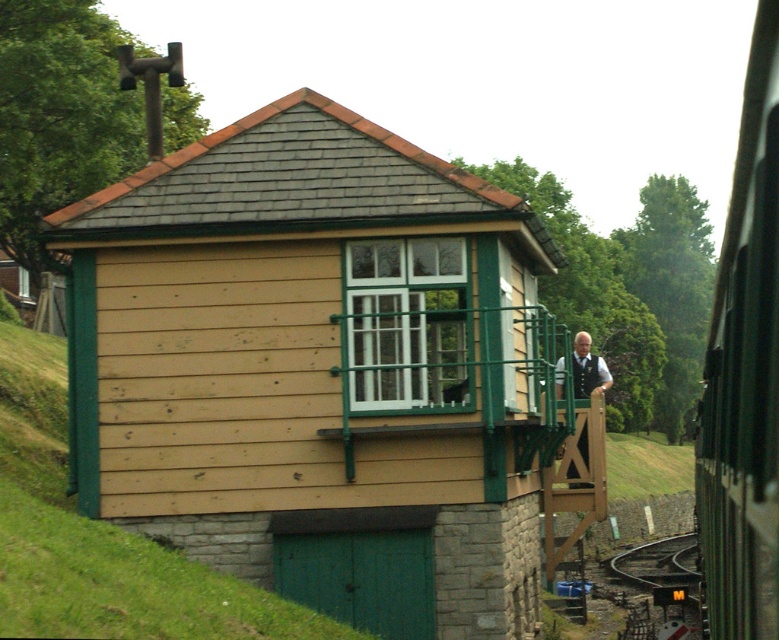
Question: Can you confirm if white plastic window at center is positioned to the left of smooth metal train track at lower right?

Choices:
 (A) yes
 (B) no

Answer: (A)

Question: Which of the following is the farthest from the observer?

Choices:
 (A) green textured vest at center
 (B) smooth metal train track at lower right

Answer: (B)

Question: Is green metallic train at right positioned before green metal balcony at center?

Choices:
 (A) no
 (B) yes

Answer: (B)

Question: Among these points, which one is nearest to the camera?

Choices:
 (A) (598, 365)
 (B) (700, 509)

Answer: (A)

Question: Which of these objects is positioned farthest from the green textured vest at center?

Choices:
 (A) beige wood shed at center
 (B) smooth metal train track at lower right
 (C) white plastic window at center

Answer: (B)

Question: Does white plastic window at center have a smaller size compared to green textured vest at center?

Choices:
 (A) no
 (B) yes

Answer: (B)